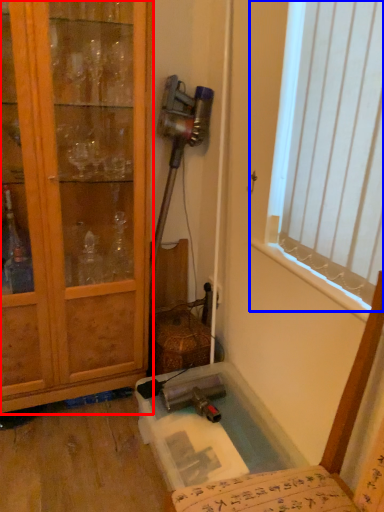
Question: Which object appears closest to the camera in this image, cabinetry (highlighted by a red box) or window (highlighted by a blue box)?

Choices:
 (A) cabinetry
 (B) window

Answer: (B)